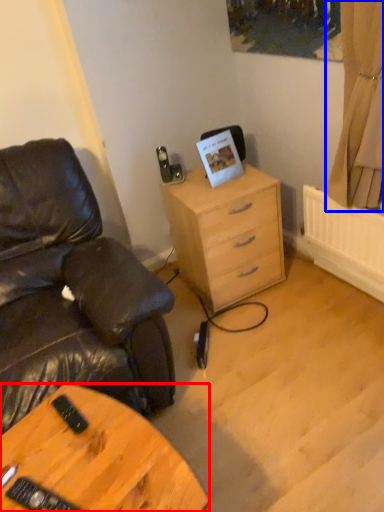
Question: Which object is further to the camera taking this photo, desk (highlighted by a red box) or curtain (highlighted by a blue box)?

Choices:
 (A) desk
 (B) curtain

Answer: (B)